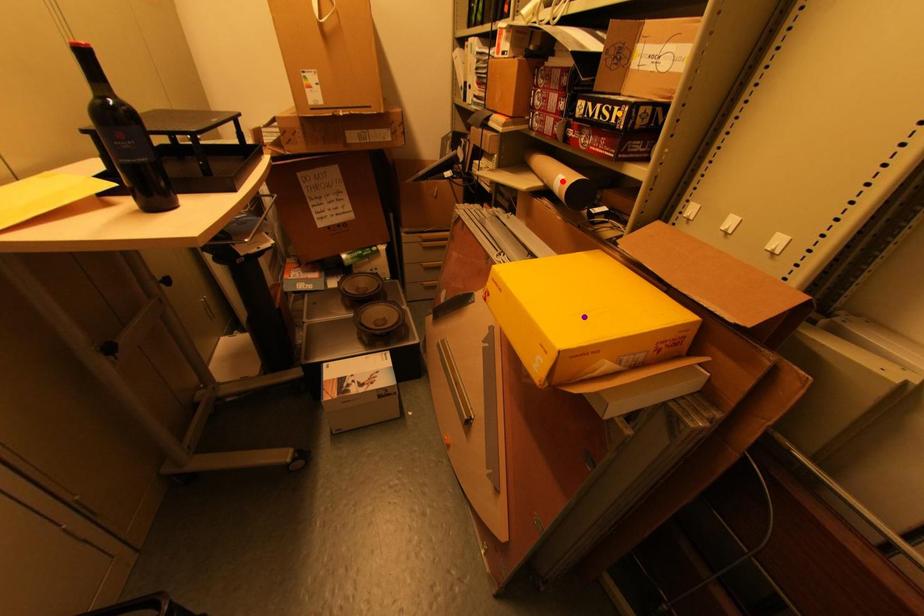
Order these from nearest to farthest:
- purple point
- red point
- orange point

1. purple point
2. orange point
3. red point